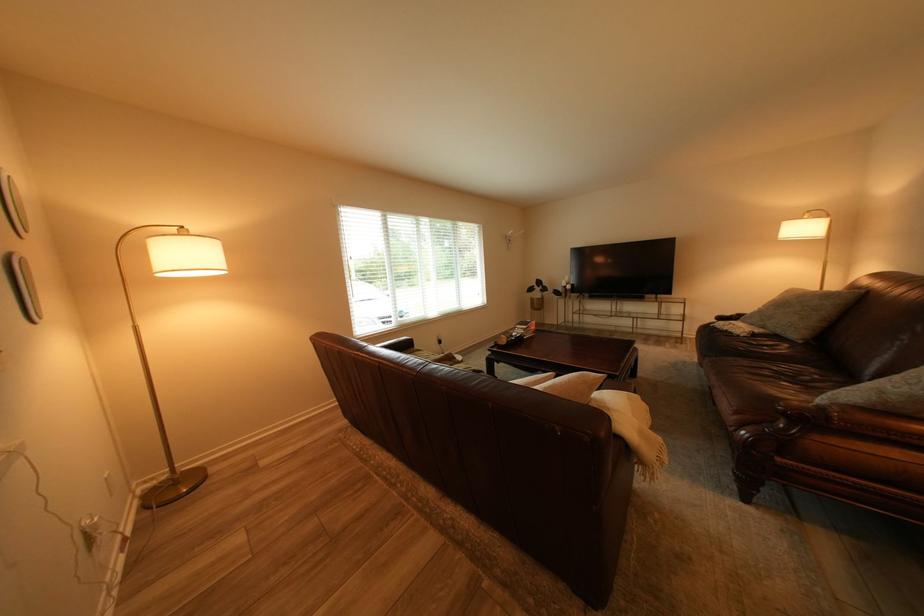
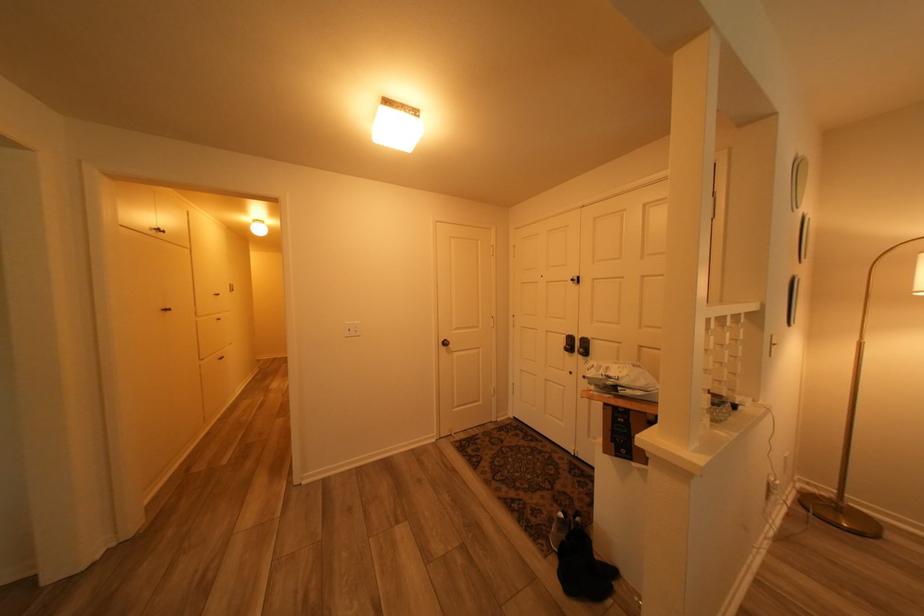
Question: The first image is from the beginning of the video and the second image is from the end. How did the camera likely rotate when shooting the video?

Choices:
 (A) Left
 (B) Right
 (C) Up
 (D) Down

Answer: (A)